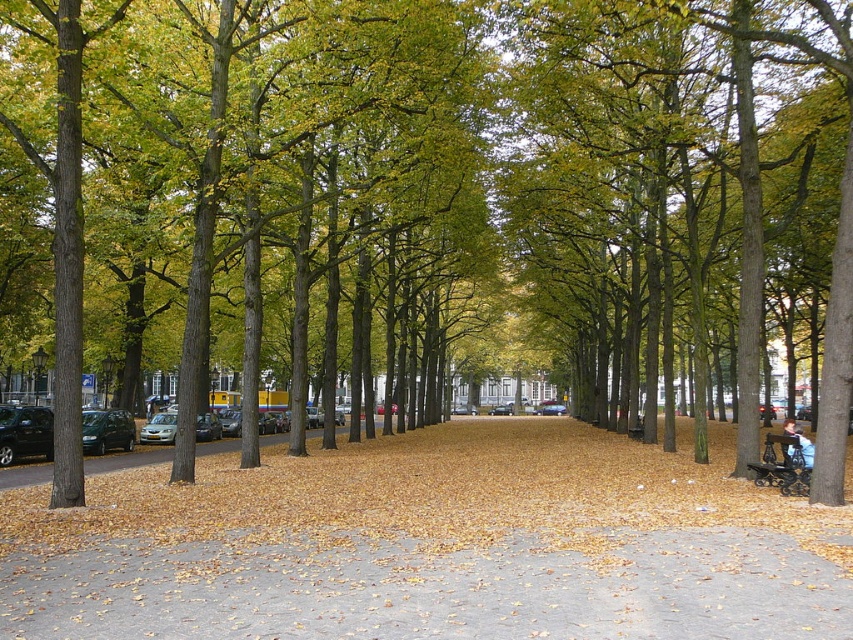
You are a person walking along the park path and you see the wooden park bench at lower right and the light brown leather jacket at lower right. Which object is closer to you?

The wooden park bench at lower right is closer to you because the light brown leather jacket at lower right is behind it.

You are a park visitor who wants to sit on the wooden park bench at lower right. There is a light brown leather jacket at lower right on the ground. Can you sit on the bench without stepping on the jacket?

The wooden park bench at lower right is located above the light brown leather jacket at lower right, so you can sit on the bench without stepping on the jacket as it is positioned above the jacket.